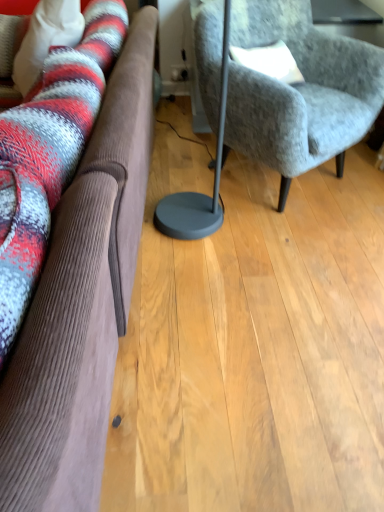
What do you see at coordinates (299, 91) in the screenshot? I see `textured gray armchair at center` at bounding box center [299, 91].

At what (x,y) coordinates should I click in order to perform the action: click on textured gray armchair at center. Please return your answer as a coordinate pair (x, y). Image resolution: width=384 pixels, height=512 pixels. Looking at the image, I should click on (299, 91).

This screenshot has width=384, height=512. I want to click on textured gray armchair at center, so click(x=299, y=91).